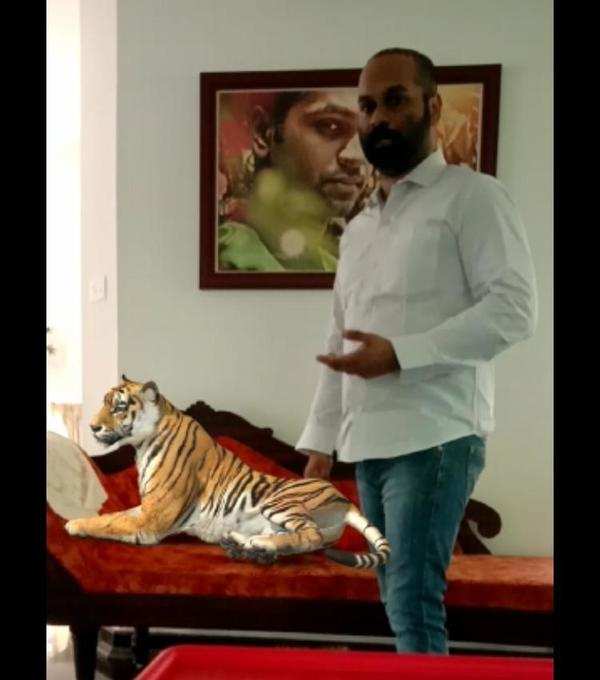
Locate an element on the screen. This screenshot has height=680, width=600. red tray is located at coordinates (301, 668).